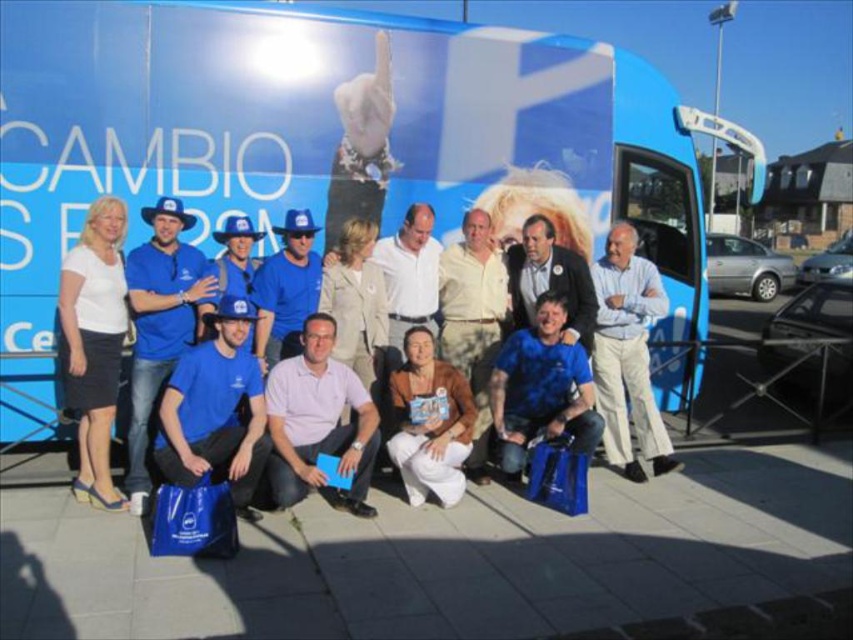
You are a photographer trying to capture a clear shot of the matte blue shirt at center and the blue fabric shirt at center. Which one should you zoom in on if you want to focus on the larger one?

The matte blue shirt at center is bigger than the blue fabric shirt at center, so you should zoom in on the matte blue shirt at center to focus on the larger one.

You are a photographer trying to capture a clear shot of the blue fabric shirt at center without the blue fabric bag at lower left blocking it. Based on the scene, what adjustment should you make to your camera position?

The blue fabric bag at lower left is in front of the blue fabric shirt at center, so to avoid the bag blocking the shirt, you should move your camera position to the right or left to shift the angle, ensuring the shirt becomes visible behind or beside the bag.